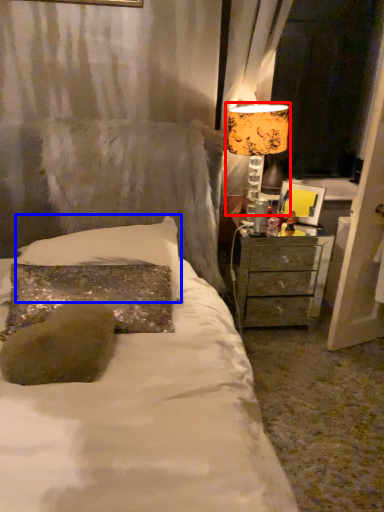
Question: Which point is further to the camera, table lamp (highlighted by a red box) or pillow (highlighted by a blue box)?

Choices:
 (A) table lamp
 (B) pillow

Answer: (A)